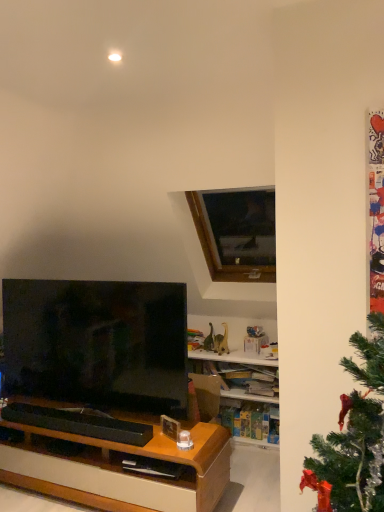
Question: Can you see wooden frame at upper center touching matte black tv at left?

Choices:
 (A) yes
 (B) no

Answer: (B)

Question: Is wooden frame at upper center further to the viewer compared to matte black tv at left?

Choices:
 (A) no
 (B) yes

Answer: (B)

Question: Considering the relative sizes of wooden frame at upper center and matte black tv at left in the image provided, is wooden frame at upper center thinner than matte black tv at left?

Choices:
 (A) yes
 (B) no

Answer: (B)

Question: Does wooden frame at upper center have a greater width compared to matte black tv at left?

Choices:
 (A) yes
 (B) no

Answer: (A)

Question: Would you say matte black tv at left is part of wooden frame at upper center's contents?

Choices:
 (A) no
 (B) yes

Answer: (A)

Question: From the image's perspective, is wooden frame at upper center over matte black tv at left?

Choices:
 (A) yes
 (B) no

Answer: (A)

Question: Can you confirm if matte black tv at left is wider than wooden frame at upper center?

Choices:
 (A) no
 (B) yes

Answer: (A)

Question: Is matte black tv at left with wooden frame at upper center?

Choices:
 (A) yes
 (B) no

Answer: (B)

Question: From the image's perspective, is matte black tv at left beneath wooden frame at upper center?

Choices:
 (A) no
 (B) yes

Answer: (B)

Question: From a real-world perspective, is matte black tv at left beneath wooden frame at upper center?

Choices:
 (A) yes
 (B) no

Answer: (A)

Question: Considering the relative sizes of matte black tv at left and wooden frame at upper center in the image provided, is matte black tv at left smaller than wooden frame at upper center?

Choices:
 (A) no
 (B) yes

Answer: (B)

Question: Is matte black tv at left further to camera compared to wooden frame at upper center?

Choices:
 (A) yes
 (B) no

Answer: (B)

Question: From a real-world perspective, is matte black tv at left positioned above or below wooden frame at upper center?

Choices:
 (A) below
 (B) above

Answer: (A)